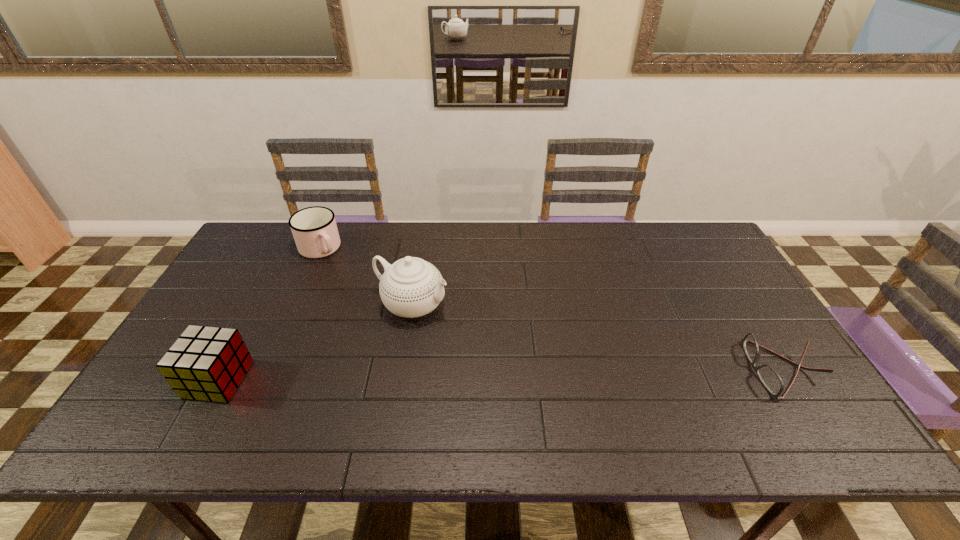
At what (x,y) coordinates should I click in order to perform the action: click on cube. Please return your answer as a coordinate pair (x, y). Image resolution: width=960 pixels, height=540 pixels. Looking at the image, I should click on (205, 363).

Locate an element on the screen. The height and width of the screenshot is (540, 960). the shortest object is located at coordinates (771, 380).

In order to click on spectacles in this screenshot , I will do `click(771, 380)`.

Where is `chinaware`? chinaware is located at coordinates (411, 287).

This screenshot has width=960, height=540. Identify the location of the second farthest object. (411, 287).

Find the location of a particular element. This screenshot has width=960, height=540. the farthest object is located at coordinates (314, 229).

Locate an element on the screen. The image size is (960, 540). free space located on the right of the cube is located at coordinates (324, 380).

Locate an element on the screen. This screenshot has height=540, width=960. free region located 0.390m on the front-facing side of the shortest object is located at coordinates (597, 369).

The height and width of the screenshot is (540, 960). In order to click on vacant space located 0.100m on the front-facing side of the shortest object in this screenshot , I will do `click(711, 369)`.

Locate an element on the screen. The height and width of the screenshot is (540, 960). blank space located on the front-facing side of the shortest object is located at coordinates (636, 369).